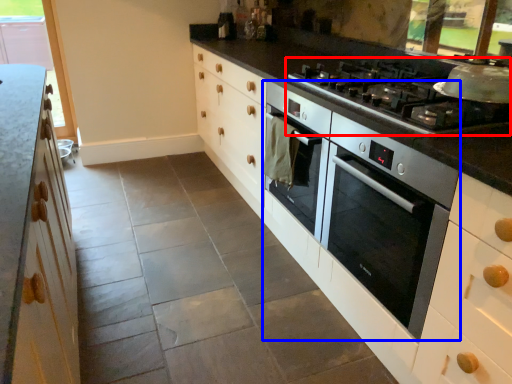
Question: Which point is closer to the camera, gas stove (highlighted by a red box) or home appliance (highlighted by a blue box)?

Choices:
 (A) gas stove
 (B) home appliance

Answer: (B)